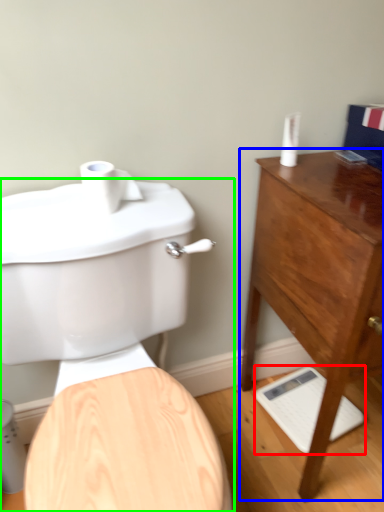
Question: Based on their relative distances, which object is farther from porcelain (highlighted by a red box)? Choose from chest of drawers (highlighted by a blue box) and toilet (highlighted by a green box).

Choices:
 (A) chest of drawers
 (B) toilet

Answer: (B)